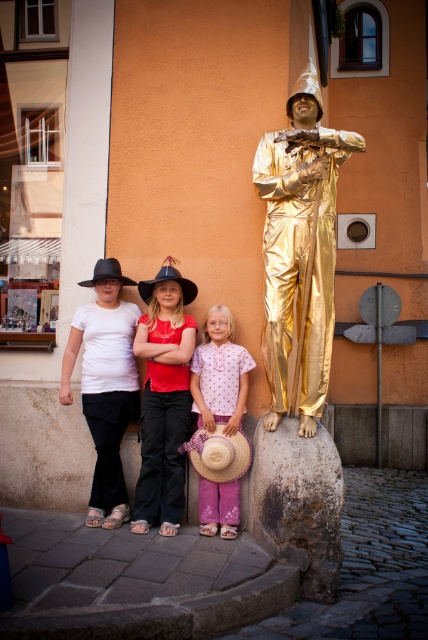
Question: Can you confirm if gold shiny statue at center is positioned to the left of strawtexturehat at lower center?

Choices:
 (A) yes
 (B) no

Answer: (B)

Question: Is matte black hats at center thinner than strawtexturehat at lower center?

Choices:
 (A) yes
 (B) no

Answer: (B)

Question: Which of the following is the closest to the observer?

Choices:
 (A) (243, 452)
 (B) (112, 294)

Answer: (A)

Question: Which object appears closest to the camera in this image?

Choices:
 (A) strawtexturehat at lower center
 (B) straw at right
 (C) black felt cowboy hat at left

Answer: (A)

Question: Can you confirm if black felt cowboy hat at center is positioned to the right of straw at right?

Choices:
 (A) no
 (B) yes

Answer: (A)

Question: Which object appears farthest from the camera in this image?

Choices:
 (A) pink fabric dress at center
 (B) matte black hats at center

Answer: (A)